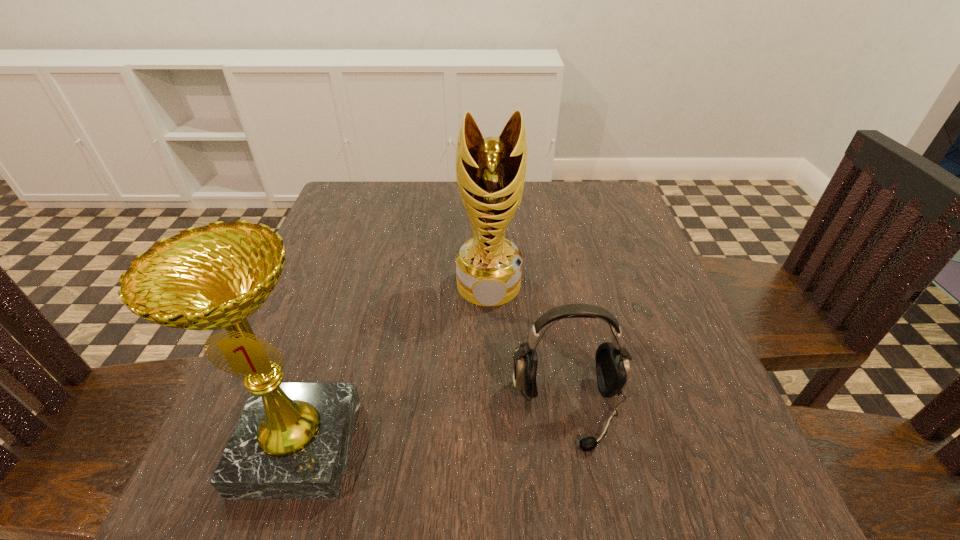
Where is `the right award`? The image size is (960, 540). the right award is located at coordinates (491, 172).

Image resolution: width=960 pixels, height=540 pixels. Identify the location of the farthest object. pos(491,172).

Identify the location of the nearer award. Image resolution: width=960 pixels, height=540 pixels. (291, 442).

At what (x,y) coordinates should I click in order to perform the action: click on the left award. Please return your answer as a coordinate pair (x, y). The height and width of the screenshot is (540, 960). Looking at the image, I should click on (291, 442).

Find the location of a particular element. This screenshot has height=540, width=960. the shortest object is located at coordinates (612, 361).

You are a GUI agent. You are given a task and a screenshot of the screen. Output one action in this format:
    pyautogui.click(x=<x>, y=<y>)
    Task: Click on the vacant space located on the front-facing side of the farther award
    This screenshot has width=960, height=540.
    Given the screenshot: What is the action you would take?
    pyautogui.click(x=492, y=472)

This screenshot has height=540, width=960. Identify the location of vacant point located with the microphone on the side of the headset. (585, 505).

The image size is (960, 540). What are the coordinates of `object at the near edge` in the screenshot? It's located at (291, 442).

The width and height of the screenshot is (960, 540). Identify the location of object situated at the left edge. (291, 442).

I want to click on object that is positioned at the right edge, so click(612, 361).